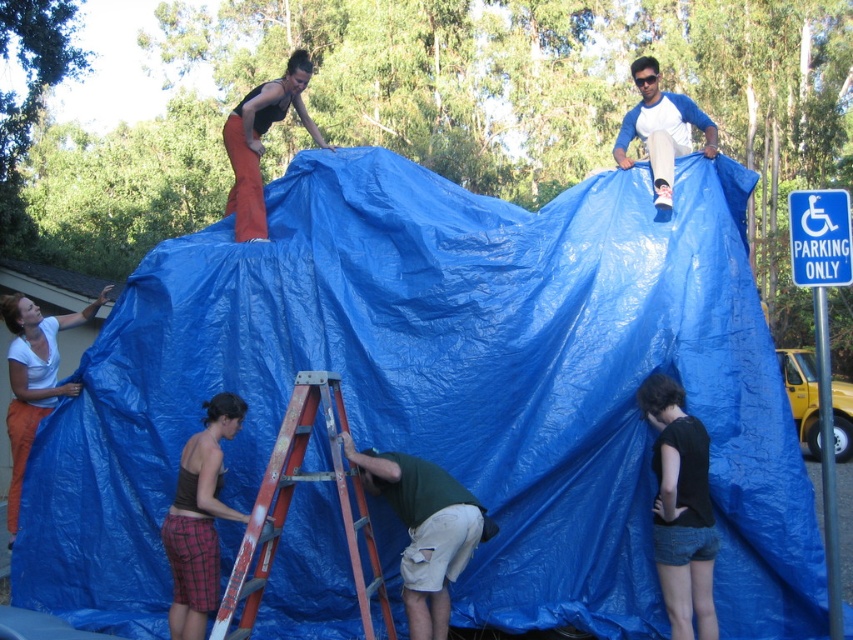
Who is positioned more to the right, green fabric at center or blue baseball shirt at upper right?

Positioned to the right is blue baseball shirt at upper right.

Which of these two, green fabric at center or blue baseball shirt at upper right, stands taller?

blue baseball shirt at upper right

Find the location of a particular element. green fabric at center is located at coordinates (425, 529).

The image size is (853, 640). What are the coordinates of `green fabric at center` in the screenshot? It's located at (425, 529).

Which of these two, plaid shorts at lower left or matte white shirt at lower left, stands shorter?

Standing shorter between the two is plaid shorts at lower left.

Locate an element on the screen. This screenshot has width=853, height=640. plaid shorts at lower left is located at coordinates (199, 518).

At what (x,y) coordinates should I click in order to perform the action: click on plaid shorts at lower left. Please return your answer as a coordinate pair (x, y). Looking at the image, I should click on tap(199, 518).

Is point (254, 134) positioned behind point (666, 195)?

Yes, it is behind point (666, 195).

What do you see at coordinates (260, 141) in the screenshot? I see `matte orange pants at upper left` at bounding box center [260, 141].

What are the coordinates of `matte orange pants at upper left` in the screenshot? It's located at (260, 141).

In order to click on matte orange pants at upper left in this screenshot , I will do `click(260, 141)`.